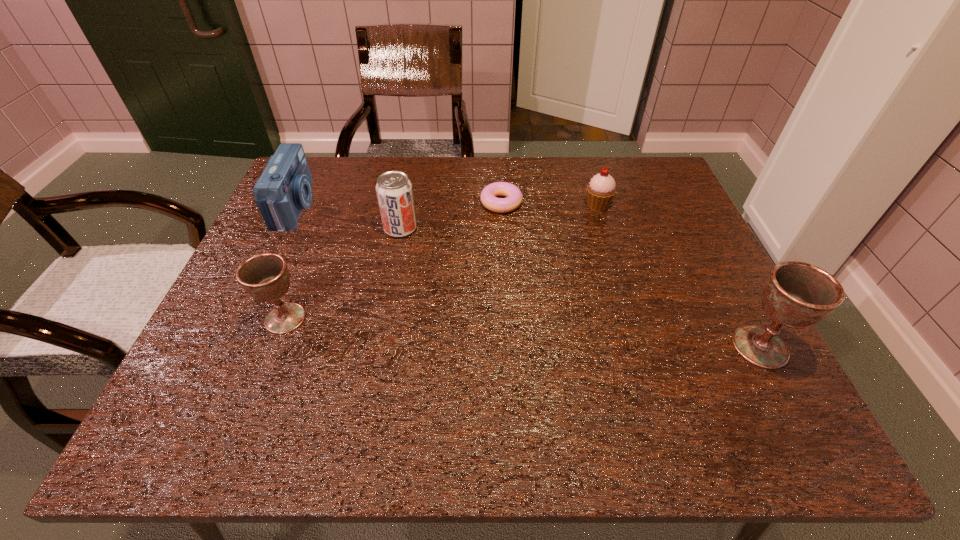
Find the location of a particular element. This screenshot has height=540, width=960. the second object from left to right is located at coordinates (265, 277).

Find the location of a particular element. This screenshot has width=960, height=540. the left chalice is located at coordinates (265, 277).

In order to click on the right chalice in this screenshot , I will do `click(796, 294)`.

This screenshot has height=540, width=960. I want to click on the tallest object, so click(x=796, y=294).

Locate an element on the screen. Image resolution: width=960 pixels, height=540 pixels. the third object from right to left is located at coordinates (489, 194).

Identify the location of the shortest object. This screenshot has width=960, height=540. (489, 194).

You are a GUI agent. You are given a task and a screenshot of the screen. Output one action in this format:
    pyautogui.click(x=<x>, y=<y>)
    Task: Click on the leftmost object
    
    Given the screenshot: What is the action you would take?
    pyautogui.click(x=284, y=188)

At what (x,y) coordinates should I click in order to perform the action: click on cupcake. Please return your answer as a coordinate pair (x, y). This screenshot has height=540, width=960. Looking at the image, I should click on (601, 189).

Where is `the fifth object from left to right`? Image resolution: width=960 pixels, height=540 pixels. the fifth object from left to right is located at coordinates (601, 189).

Locate an element on the screen. The image size is (960, 540). soda can is located at coordinates (394, 191).